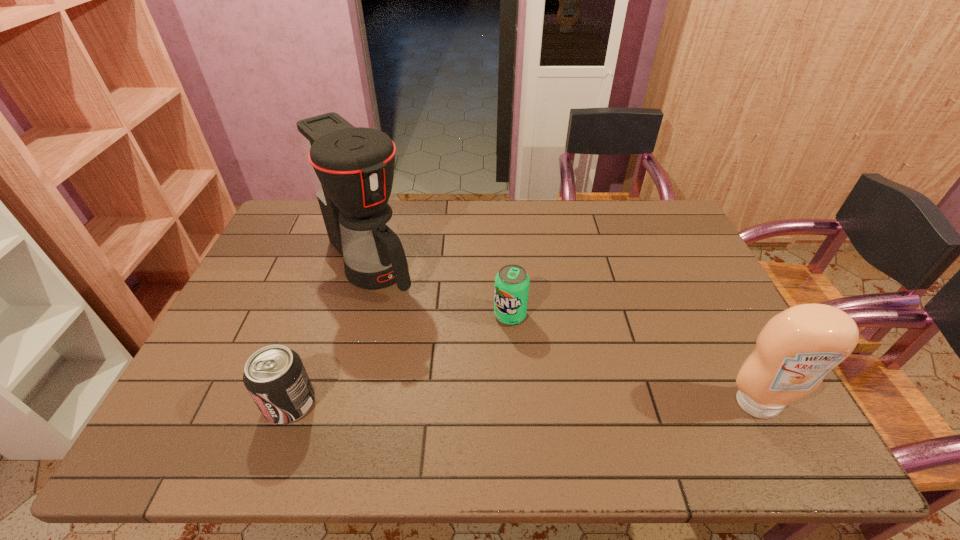
Where is `vacant spot on the desktop that is between the left pop soda and the second tallest object and is positioned pour from the carafe of the coffee maker`? The image size is (960, 540). vacant spot on the desktop that is between the left pop soda and the second tallest object and is positioned pour from the carafe of the coffee maker is located at coordinates (496, 403).

Find the location of a particular element. This screenshot has height=540, width=960. vacant spot on the desktop that is between the left pop soda and the rightmost object and is positioned on the front-facing side of the farther pop soda is located at coordinates (468, 403).